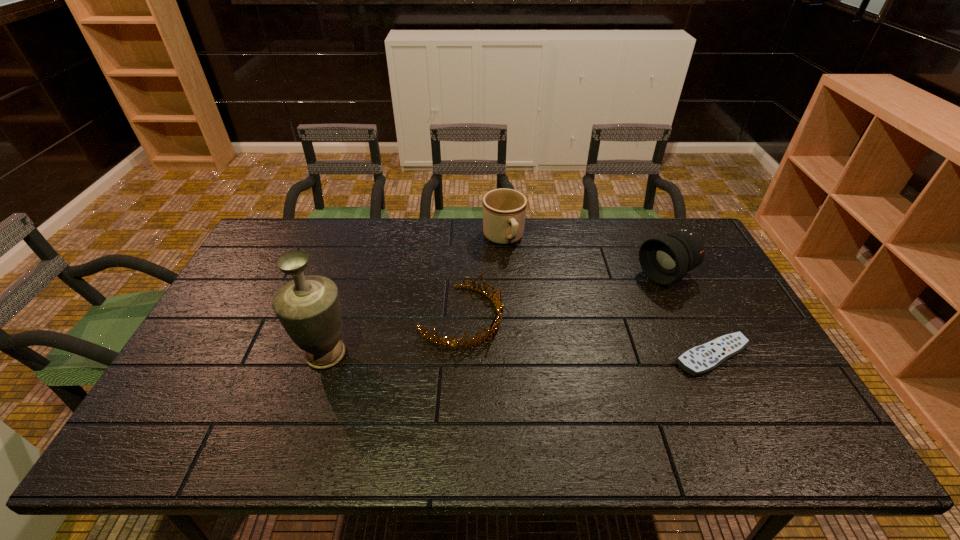
Where is `vacant space that satisfies the following two spatial constraints: 1. on the front side of the telephoto lens; 2. on the right side of the mug`? The image size is (960, 540). vacant space that satisfies the following two spatial constraints: 1. on the front side of the telephoto lens; 2. on the right side of the mug is located at coordinates (506, 275).

I want to click on free space that satisfies the following two spatial constraints: 1. on the front side of the telephoto lens; 2. on the right side of the remote control, so click(703, 356).